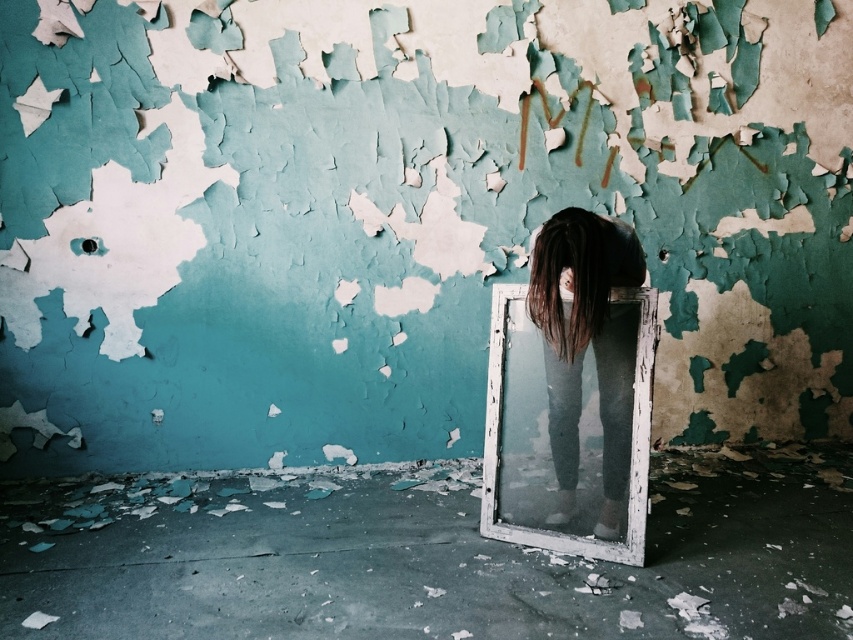
Question: Which object appears closest to the camera in this image?

Choices:
 (A) dark brown hair at center
 (B) dark brown silky hair at center

Answer: (B)

Question: Which point is closer to the camera?

Choices:
 (A) 601,241
 (B) 613,428

Answer: (A)

Question: Can you confirm if dark brown hair at center is wider than dark brown silky hair at center?

Choices:
 (A) yes
 (B) no

Answer: (A)

Question: Among these points, which one is farthest from the camera?

Choices:
 (A) (538, 312)
 (B) (605, 358)

Answer: (B)

Question: Is dark brown hair at center thinner than dark brown silky hair at center?

Choices:
 (A) no
 (B) yes

Answer: (A)

Question: Where is dark brown hair at center located in relation to dark brown silky hair at center in the image?

Choices:
 (A) left
 (B) right

Answer: (B)